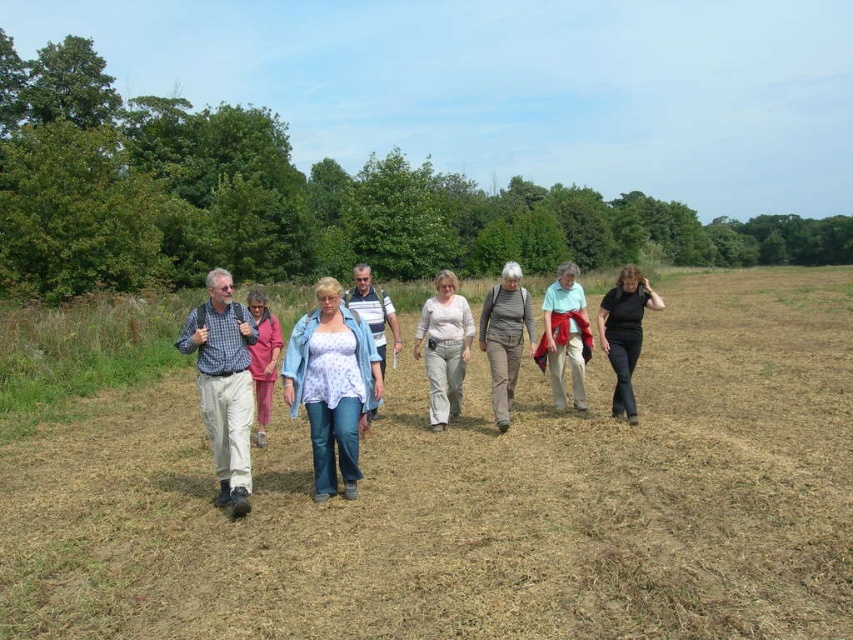
Is checkered fabric shirt at left smaller than black matte pants at lower right?

Correct, checkered fabric shirt at left occupies less space than black matte pants at lower right.

How distant is checkered fabric shirt at left from black matte pants at lower right?

checkered fabric shirt at left is 17.54 feet from black matte pants at lower right.

Between point (199, 321) and point (624, 314), which one is positioned in front?

Positioned in front is point (199, 321).

You are a GUI agent. You are given a task and a screenshot of the screen. Output one action in this format:
    pyautogui.click(x=<x>, y=<y>)
    Task: Click on the checkered fabric shirt at left
    This screenshot has width=853, height=640.
    Given the screenshot: What is the action you would take?
    pyautogui.click(x=223, y=385)

Between blue denim jeans at center and black matte pants at lower right, which one appears on the right side from the viewer's perspective?

black matte pants at lower right

Is blue denim jeans at center taller than black matte pants at lower right?

Incorrect, blue denim jeans at center's height is not larger of black matte pants at lower right's.

I want to click on blue denim jeans at center, so click(x=332, y=385).

Does brown grassy field at center have a greater height compared to checkered fabric shirt at left?

Correct, brown grassy field at center is much taller as checkered fabric shirt at left.

Does brown grassy field at center appear on the right side of checkered fabric shirt at left?

Yes, brown grassy field at center is to the right of checkered fabric shirt at left.

I want to click on brown grassy field at center, so click(x=476, y=500).